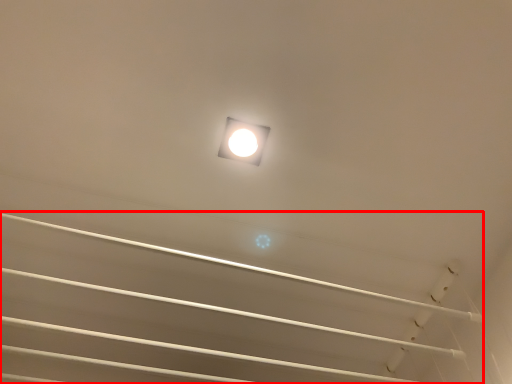
Question: From the image, what is the correct spatial relationship of stairwell (annotated by the red box) in relation to lamp?

Choices:
 (A) right
 (B) left

Answer: (B)